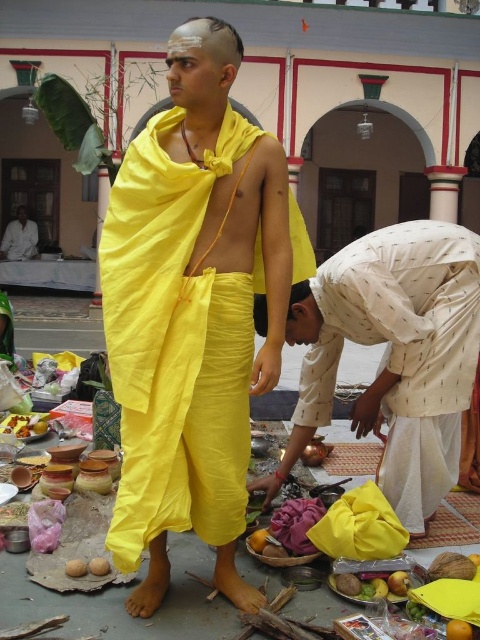
Question: Does orange matte at lower right appear over smooth brown potato at lower left?

Choices:
 (A) yes
 (B) no

Answer: (B)

Question: Can you confirm if yellow cloth at center is smaller than smooth clay pot at lower left?

Choices:
 (A) yes
 (B) no

Answer: (B)

Question: Among these points, which one is farthest from the camera?

Choices:
 (A) [455, 632]
 (B) [46, 416]

Answer: (B)

Question: Which point is closer to the camera?

Choices:
 (A) (394, 486)
 (B) (459, 625)

Answer: (B)

Question: Does yellow cloth at center have a larger size compared to white cotton cloth at lower left?

Choices:
 (A) yes
 (B) no

Answer: (A)

Question: Which point is closer to the camera?

Choices:
 (A) (242, 244)
 (B) (467, 632)
 (C) (28, 230)

Answer: (B)